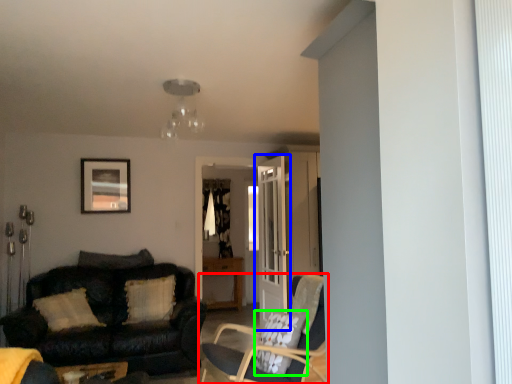
Question: Which is nearer to the chair (highlighted by a red box)? door (highlighted by a blue box) or pillow (highlighted by a green box).

Choices:
 (A) door
 (B) pillow

Answer: (B)